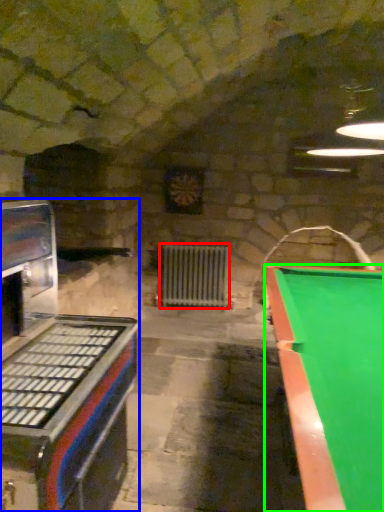
Question: Considering the real-world distances, which object is closest to radiator (highlighted by a red box)? appliance (highlighted by a blue box) or billiard table (highlighted by a green box).

Choices:
 (A) appliance
 (B) billiard table

Answer: (B)